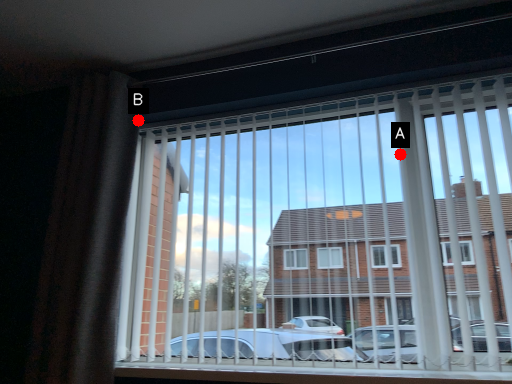
Question: Two points are circled on the image, labeled by A and B beside each circle. Which point is closer to the camera?

Choices:
 (A) A is closer
 (B) B is closer

Answer: (A)